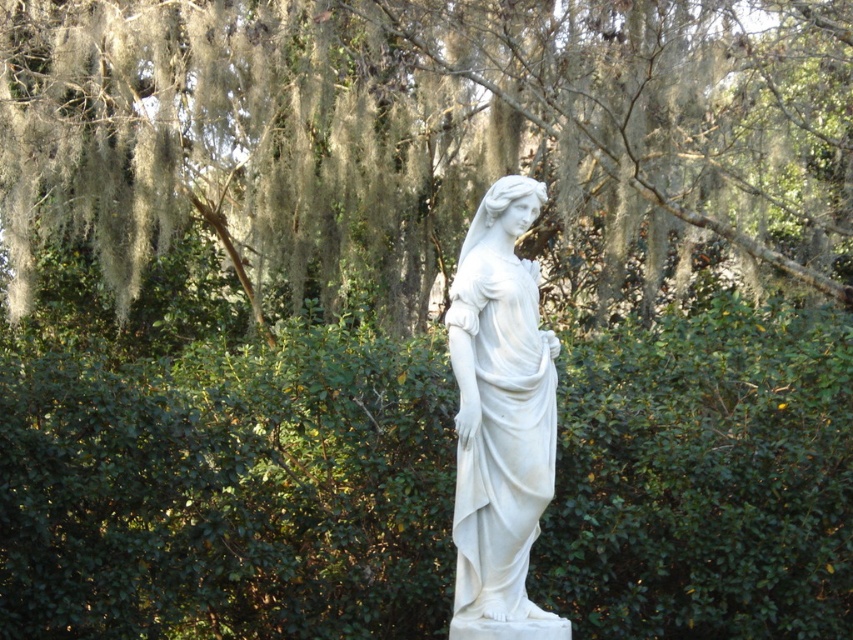
Question: Is green mossy tree at center above white marble statue at center?

Choices:
 (A) yes
 (B) no

Answer: (A)

Question: Which point is closer to the camera?

Choices:
 (A) [531, 618]
 (B) [851, 202]

Answer: (A)

Question: Is green mossy tree at center to the left of white marble statue at center from the viewer's perspective?

Choices:
 (A) yes
 (B) no

Answer: (A)

Question: Among these points, which one is nearest to the camera?

Choices:
 (A) (578, 296)
 (B) (462, 344)

Answer: (B)

Question: Does green mossy tree at center appear over white marble statue at center?

Choices:
 (A) yes
 (B) no

Answer: (A)